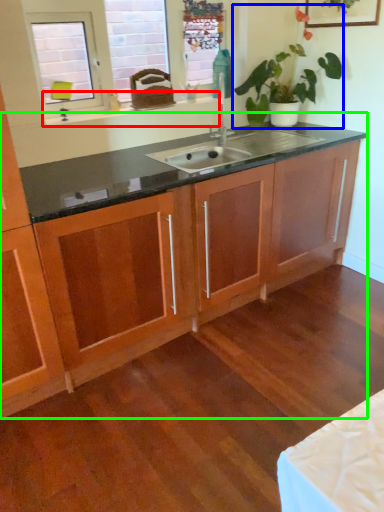
Question: Based on their relative distances, which object is nearer to window sill (highlighted by a red box)? Choose from houseplant (highlighted by a blue box) and dresser (highlighted by a green box).

Choices:
 (A) houseplant
 (B) dresser

Answer: (A)